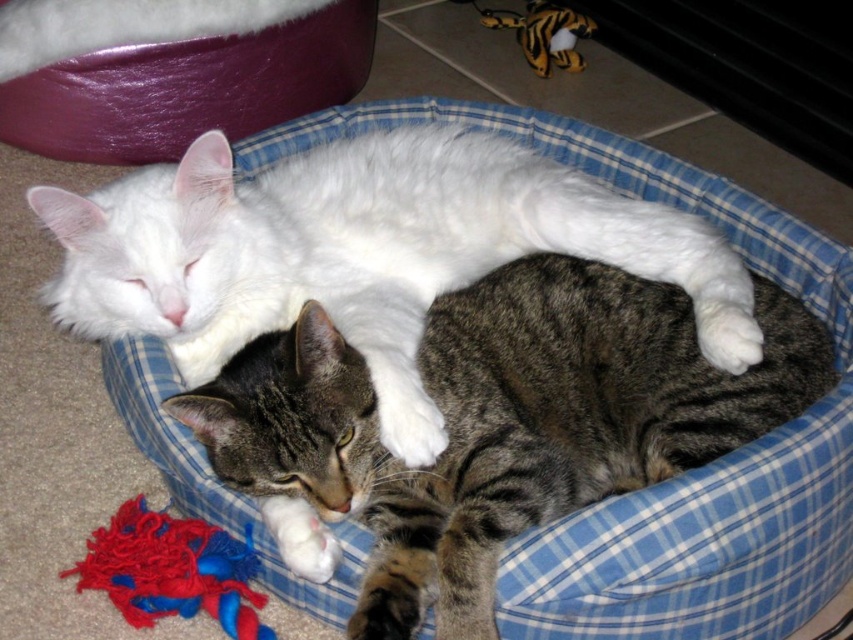
Question: Is tabby fur cat at center bigger than white fluffy cat at center?

Choices:
 (A) no
 (B) yes

Answer: (A)

Question: Which object appears closest to the camera in this image?

Choices:
 (A) white fluffy cat at center
 (B) tabby fur cat at center
 (C) yarn fabric toy at lower left

Answer: (B)

Question: Is tabby fur cat at center bigger than white fluffy cat at center?

Choices:
 (A) no
 (B) yes

Answer: (A)

Question: Which of these objects is positioned closest to the yarn fabric toy at lower left?

Choices:
 (A) tabby fur cat at center
 (B) white fluffy cat at center

Answer: (A)

Question: Which object is the closest to the tabby fur cat at center?

Choices:
 (A) yarn fabric toy at lower left
 (B) white fluffy cat at center

Answer: (B)

Question: Is tabby fur cat at center further to camera compared to white fluffy cat at center?

Choices:
 (A) yes
 (B) no

Answer: (B)